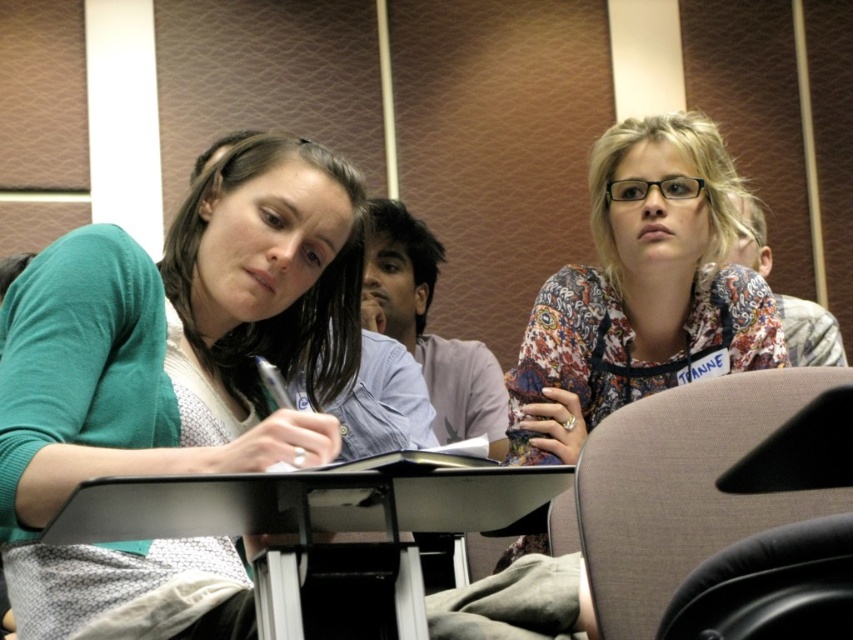
Question: Which object is positioned closest to the black plastic table at center?

Choices:
 (A) floral fabric blouse at upper right
 (B) black leather chair at lower right
 (C) brown fabric chair at lower right
 (D) green matte sweater at left

Answer: (D)

Question: Is green matte sweater at left behind brown fabric chair at lower right?

Choices:
 (A) yes
 (B) no

Answer: (B)

Question: Which object appears farthest from the camera in this image?

Choices:
 (A) black leather chair at lower right
 (B) brown fabric chair at lower right

Answer: (B)

Question: Where is brown fabric chair at lower right located in relation to black plastic table at center in the image?

Choices:
 (A) right
 (B) left

Answer: (A)

Question: Which object is farther from the camera taking this photo?

Choices:
 (A) brown fabric chair at lower right
 (B) black plastic table at center
 (C) green matte sweater at left
 (D) black leather chair at lower right

Answer: (A)

Question: Can you confirm if black plastic table at center is bigger than black leather chair at lower right?

Choices:
 (A) no
 (B) yes

Answer: (B)